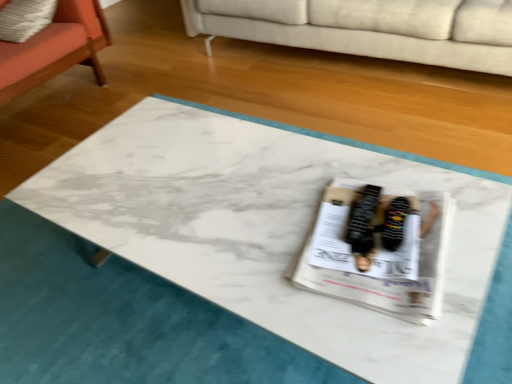
You are a GUI agent. You are given a task and a screenshot of the screen. Output one action in this format:
    pyautogui.click(x=<x>, y=<y>)
    Task: Click on the free location to the right of black suede sneakers at center
    The height and width of the screenshot is (384, 512).
    Given the screenshot: What is the action you would take?
    pyautogui.click(x=444, y=223)